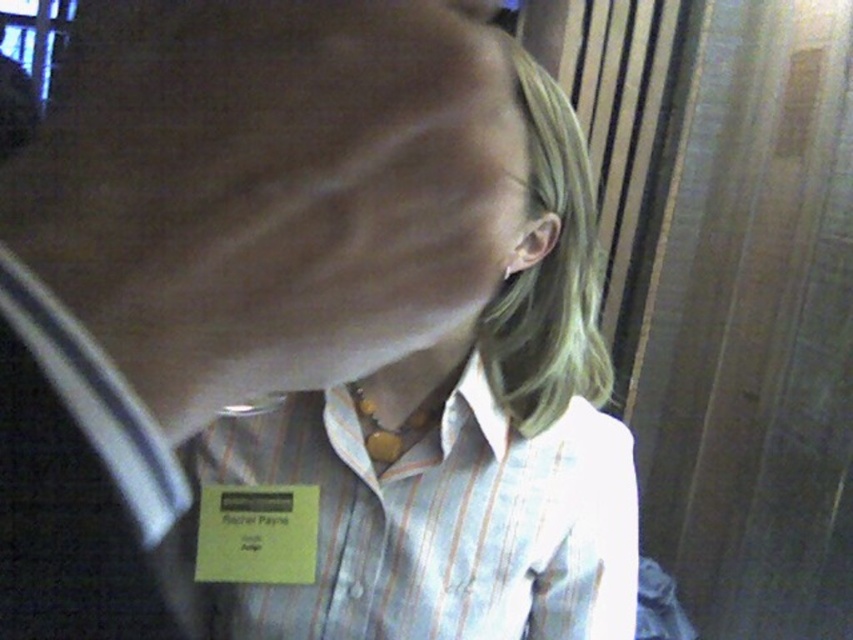
You are standing in an indoor space with wooden slats on the wall. There is a person wearing a striped shirt at center. A point is marked at coordinate (461, 449). Where is this point located?

The point at coordinate (461, 449) is on the white striped shirt at center.

You are organizing a clothing store and need to arrange the white striped shirt at center and white striped dress shirt at center on a hanger rack. According to their positions in the image, which shirt should be placed to the left side of the rack?

The white striped dress shirt at center should be placed to the left side of the rack because the white striped shirt at center is positioned to its right in the image.